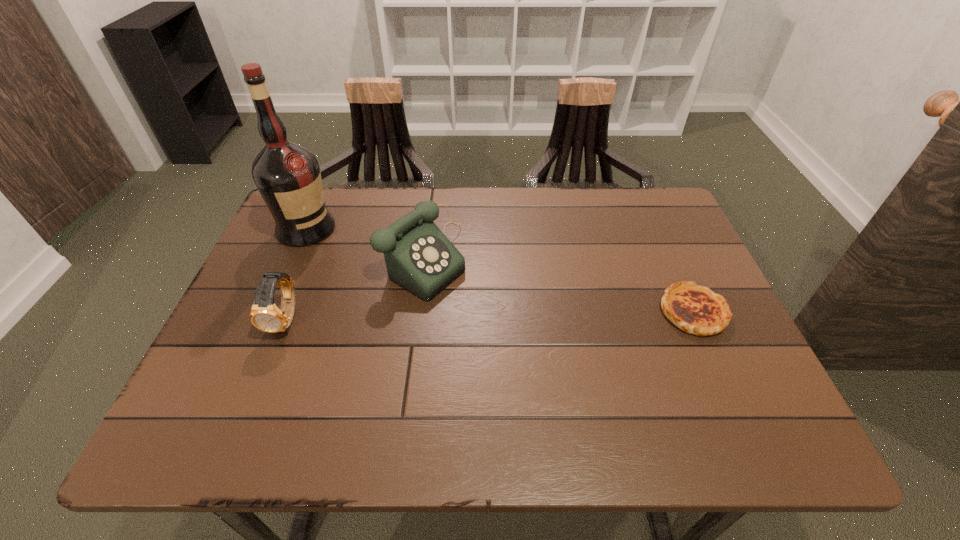
The height and width of the screenshot is (540, 960). In the image, there is a desktop. What are the coordinates of `free space at the far edge` in the screenshot? It's located at (419, 194).

Image resolution: width=960 pixels, height=540 pixels. In the image, there is a desktop. Find the location of `vacant space at the near edge`. vacant space at the near edge is located at coordinates (666, 376).

The width and height of the screenshot is (960, 540). Find the location of `free region at the left edge of the desktop`. free region at the left edge of the desktop is located at coordinates (312, 279).

Find the location of a particular element. This screenshot has width=960, height=540. vacant space at the right edge of the desktop is located at coordinates (698, 267).

The width and height of the screenshot is (960, 540). I want to click on blank space at the far left corner of the desktop, so click(345, 205).

Locate an element on the screen. vacant region at the near left corner of the desktop is located at coordinates tap(208, 369).

In the image, there is a desktop. In order to click on vacant area at the far right corner in this screenshot , I will do `click(636, 210)`.

You are a GUI agent. You are given a task and a screenshot of the screen. Output one action in this format:
    pyautogui.click(x=<x>, y=<y>)
    Task: Click on the vacant area between the liquor and the rightmost object
    The height and width of the screenshot is (540, 960).
    Given the screenshot: What is the action you would take?
    pyautogui.click(x=499, y=270)

The image size is (960, 540). I want to click on unoccupied position between the rightmost object and the tallest object, so click(x=499, y=270).

The width and height of the screenshot is (960, 540). I want to click on unoccupied area between the second shortest object and the shortest object, so click(490, 315).